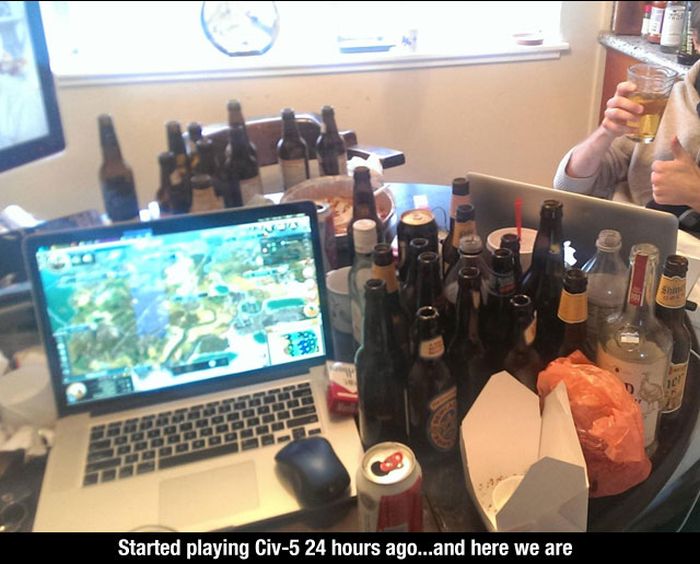
Find the location of `bottle`. bottle is located at coordinates (437, 372).